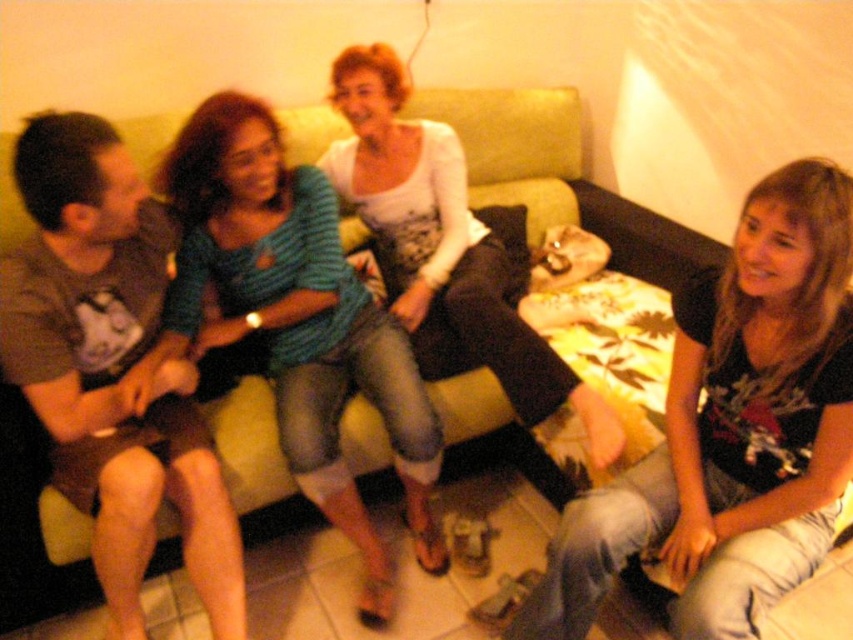
Question: Among these objects, which one is nearest to the camera?

Choices:
 (A) blue striped shirt at center
 (B) black matte shirt at center
 (C) white matte shirt at center
 (D) matte brown shirt at left

Answer: (B)

Question: Does blue striped shirt at center have a smaller size compared to white matte shirt at center?

Choices:
 (A) no
 (B) yes

Answer: (B)

Question: Which of the following is the closest to the observer?

Choices:
 (A) (79, 259)
 (B) (755, 476)

Answer: (A)

Question: From the image, what is the correct spatial relationship of black matte shirt at center in relation to matte brown shirt at left?

Choices:
 (A) left
 (B) right

Answer: (B)

Question: Which object is farther from the camera taking this photo?

Choices:
 (A) white matte shirt at center
 (B) matte brown shirt at left
 (C) black matte shirt at center
 (D) blue striped shirt at center

Answer: (A)

Question: From the image, what is the correct spatial relationship of blue striped shirt at center in relation to white matte shirt at center?

Choices:
 (A) above
 (B) below

Answer: (B)